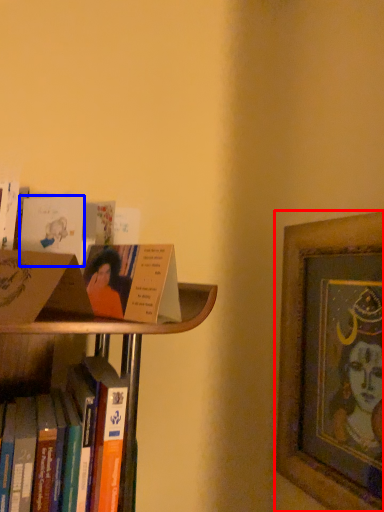
Question: Among these objects, which one is farthest to the camera, picture frame (highlighted by a red box) or paperback book (highlighted by a blue box)?

Choices:
 (A) picture frame
 (B) paperback book

Answer: (A)